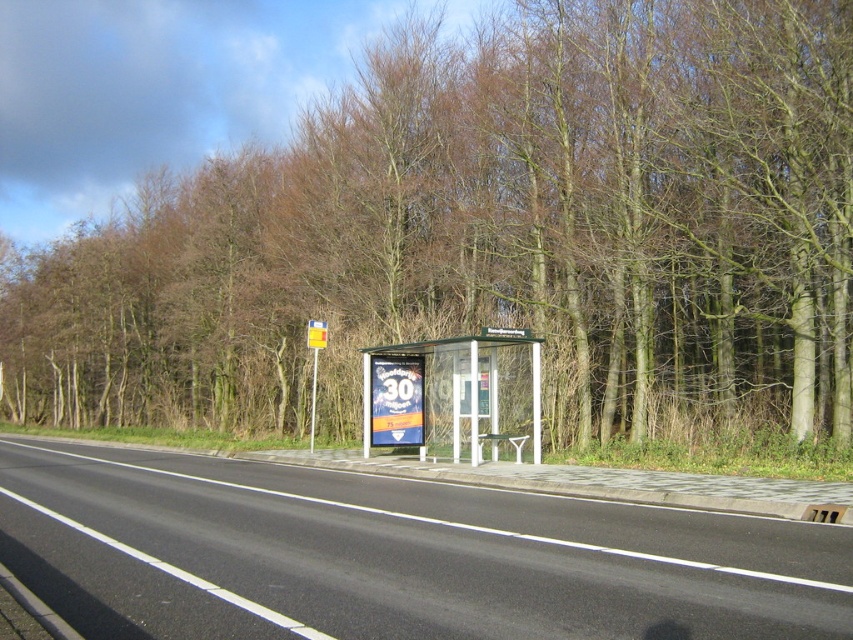
What do you see at coordinates (495, 230) in the screenshot?
I see `brown leafless trees at center` at bounding box center [495, 230].

Can you confirm if brown leafless trees at center is shorter than yellow plastic sign at center?

Incorrect, brown leafless trees at center's height does not fall short of yellow plastic sign at center's.

Is point (645, 204) behind point (316, 376)?

No, (645, 204) is in front of (316, 376).

Locate an element on the screen. brown leafless trees at center is located at coordinates (495, 230).

Who is more distant from viewer, (x=76, y=472) or (x=312, y=433)?

The point (x=312, y=433) is behind.

Is point (96, 451) positioned before point (309, 436)?

Yes, it is.

Where is `black asphalt highway at center`? The width and height of the screenshot is (853, 640). black asphalt highway at center is located at coordinates (393, 556).

Looking at this image, is transparent plastic bus stop at center to the right of yellow plastic sign at center from the viewer's perspective?

Correct, you'll find transparent plastic bus stop at center to the right of yellow plastic sign at center.

Based on the photo, can you confirm if transparent plastic bus stop at center is thinner than yellow plastic sign at center?

No.

Image resolution: width=853 pixels, height=640 pixels. Describe the element at coordinates (456, 396) in the screenshot. I see `transparent plastic bus stop at center` at that location.

At what (x,y) coordinates should I click in order to perform the action: click on transparent plastic bus stop at center. Please return your answer as a coordinate pair (x, y). This screenshot has width=853, height=640. Looking at the image, I should click on click(x=456, y=396).